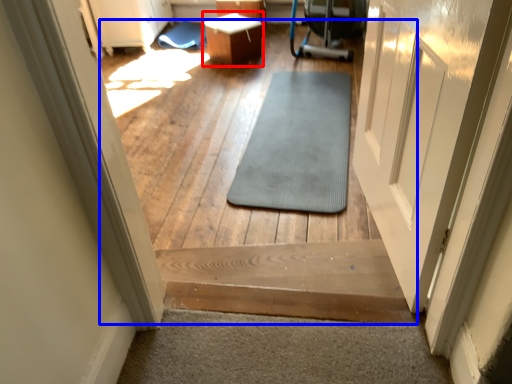
Question: Which of the following is the farthest to the observer, table (highlighted by a red box) or path (highlighted by a blue box)?

Choices:
 (A) table
 (B) path

Answer: (A)